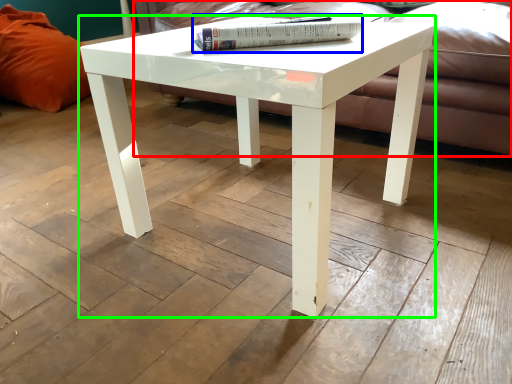
Question: Which object is the closest to the couch (highlighted by a red box)? Choose among these: book (highlighted by a blue box) or coffee table (highlighted by a green box).

Choices:
 (A) book
 (B) coffee table

Answer: (A)